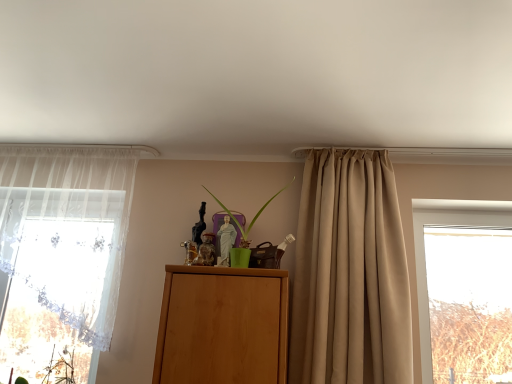
Question: Is beige satin curtain at center, the 1th curtain in the right-to-left sequence, wider or thinner than sheer white curtain at left, positioned as the 1th curtain in left-to-right order?

Choices:
 (A) thin
 (B) wide

Answer: (B)

Question: Based on their sizes in the image, would you say beige satin curtain at center, the 1th curtain in the right-to-left sequence, is bigger or smaller than sheer white curtain at left, positioned as the 1th curtain in left-to-right order?

Choices:
 (A) small
 (B) big

Answer: (B)

Question: Which of these objects is positioned closest to the green matte plant at center?

Choices:
 (A) beige satin curtain at center, the 1th curtain in the right-to-left sequence
 (B) sheer white curtain at left, the second curtain viewed from the right

Answer: (A)

Question: Estimate the real-world distances between objects in this image. Which object is farther from the beige satin curtain at center, the 1th curtain in the right-to-left sequence?

Choices:
 (A) green matte plant at center
 (B) sheer white curtain at left, the second curtain viewed from the right

Answer: (B)